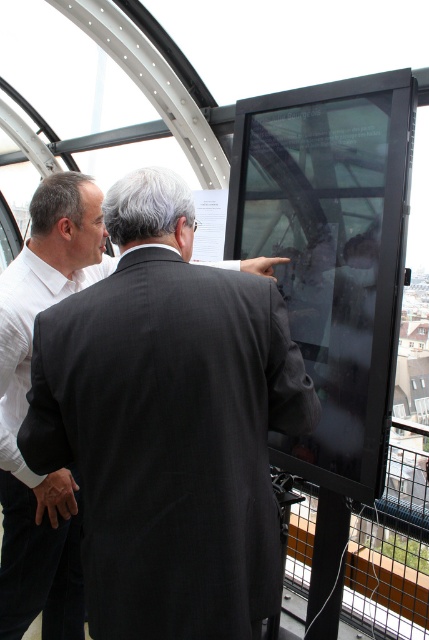
Question: Which point is farther to the camera?

Choices:
 (A) white shirt at left
 (B) black wool suit at center

Answer: (A)

Question: Which point is closer to the camera?

Choices:
 (A) (151, 401)
 (B) (57, 257)

Answer: (A)

Question: Which of the following is the closest to the observer?

Choices:
 (A) white shirt at left
 (B) black wool suit at center

Answer: (B)

Question: Can you confirm if black wool suit at center is bigger than white shirt at left?

Choices:
 (A) yes
 (B) no

Answer: (B)

Question: Can you confirm if black wool suit at center is positioned to the right of white shirt at left?

Choices:
 (A) no
 (B) yes

Answer: (B)

Question: In this image, where is black wool suit at center located relative to white shirt at left?

Choices:
 (A) right
 (B) left

Answer: (A)